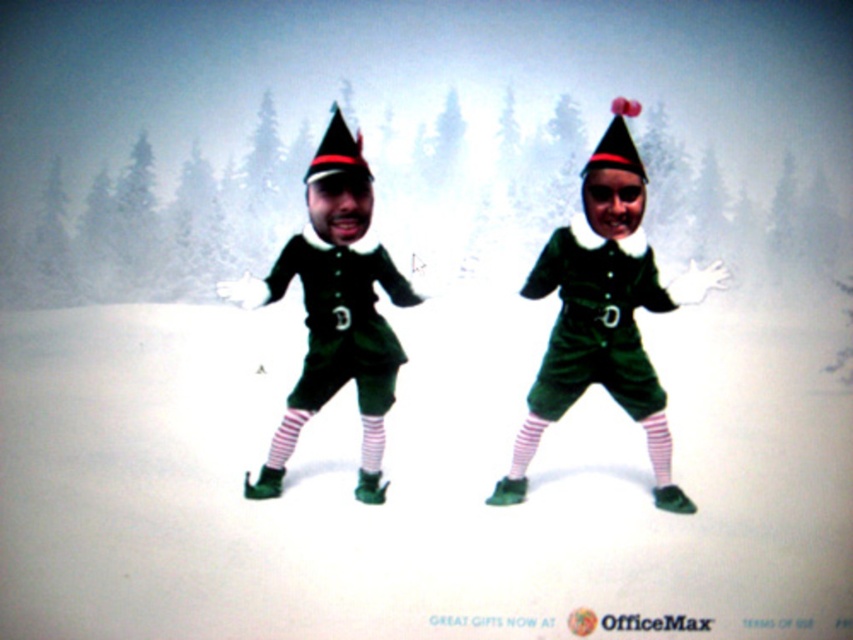
You are an elf in the image and want to know your exact location. Based on the scene description, where would you find the green velvet elf at center?

The green velvet elf at center is located at point (x=610, y=301).

You are an elf in the image and want to place a small decoration exactly at the center of the matte green fabric christmas hat at center. According to the image coordinates, where should you place it?

The center of the matte green fabric christmas hat at center is located at coordinates point (337, 150), so you should place the decoration there.

You are a photographer setting up a camera to capture the green velvet elf at center and the matte black christmas hat at upper center. The camera requires both subjects to be within a 10 inch frame. Can you fit both into the frame?

The green velvet elf at center and the matte black christmas hat at upper center are 10.55 inches apart from each other, which exceeds the 10 inch frame requirement. Therefore, both subjects cannot be captured within the same frame.